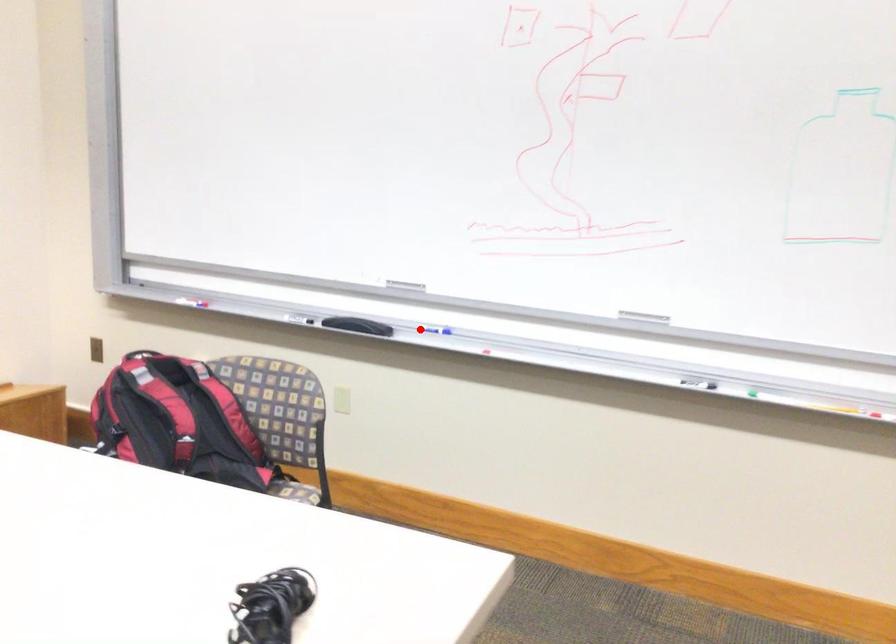
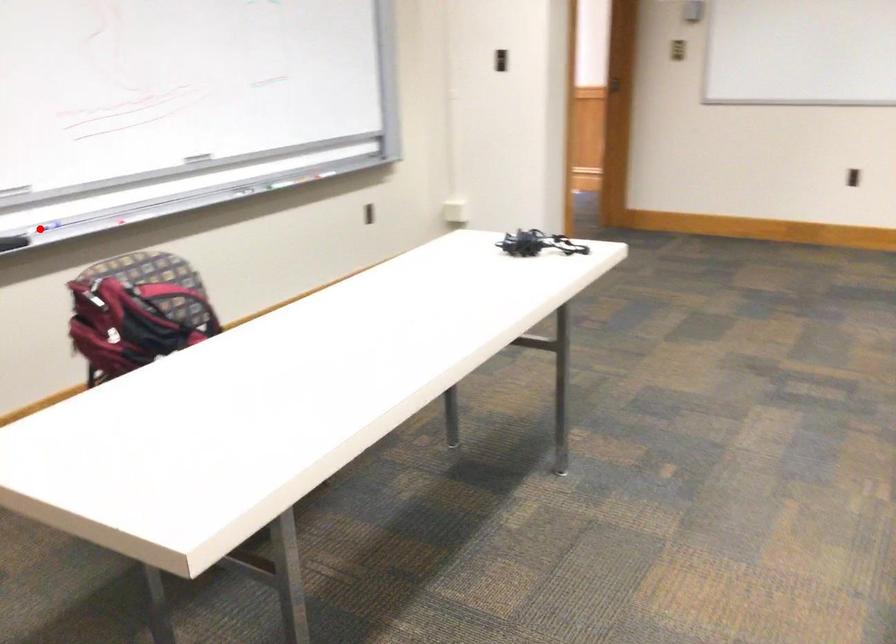
I am providing you with two images of the same scene from different viewpoints. A red point is marked on the first image and another point is marked on the second image. Is the red point in image1 aligned with the point shown in image2?

Yes